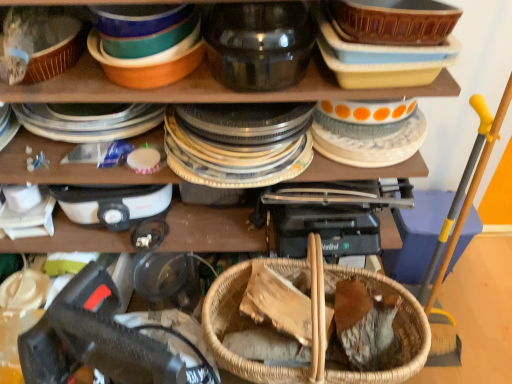
Question: Considering the relative sizes of woven wood basket at center and transparent glass jar at upper center, the first tableware from the left, in the image provided, is woven wood basket at center wider than transparent glass jar at upper center, the first tableware from the left,?

Choices:
 (A) no
 (B) yes

Answer: (A)

Question: Can you confirm if woven wood basket at center is positioned to the right of transparent glass jar at upper center, the second tableware in the right-to-left sequence?

Choices:
 (A) no
 (B) yes

Answer: (B)

Question: Can you confirm if woven wood basket at center is smaller than transparent glass jar at upper center, the second tableware in the right-to-left sequence?

Choices:
 (A) no
 (B) yes

Answer: (A)

Question: From a real-world perspective, is woven wood basket at center positioned under transparent glass jar at upper center, the first tableware from the left, based on gravity?

Choices:
 (A) yes
 (B) no

Answer: (A)

Question: Does woven wood basket at center have a lesser height compared to transparent glass jar at upper center, the second tableware in the right-to-left sequence?

Choices:
 (A) no
 (B) yes

Answer: (A)

Question: From a real-world perspective, is woven wood basket at center positioned over transparent glass jar at upper center, the second tableware in the right-to-left sequence, based on gravity?

Choices:
 (A) no
 (B) yes

Answer: (A)

Question: Is transparent glass jar at upper center, the second tableware in the right-to-left sequence, further to camera compared to white plastic appliance at upper left?

Choices:
 (A) yes
 (B) no

Answer: (B)

Question: Does transparent glass jar at upper center, the first tableware from the left, appear on the left side of white plastic appliance at upper left?

Choices:
 (A) yes
 (B) no

Answer: (B)

Question: Can you confirm if transparent glass jar at upper center, the first tableware from the left, is positioned to the right of white plastic appliance at upper left?

Choices:
 (A) yes
 (B) no

Answer: (A)

Question: From a real-world perspective, is transparent glass jar at upper center, the first tableware from the left, physically below white plastic appliance at upper left?

Choices:
 (A) yes
 (B) no

Answer: (B)

Question: Does transparent glass jar at upper center, the first tableware from the left, have a lesser width compared to white plastic appliance at upper left?

Choices:
 (A) yes
 (B) no

Answer: (B)

Question: Is transparent glass jar at upper center, the second tableware in the right-to-left sequence, closer to the viewer compared to white plastic appliance at upper left?

Choices:
 (A) yes
 (B) no

Answer: (A)

Question: From the image's perspective, would you say white glossy plate at upper right, the 2th tableware positioned from the left, is positioned over woven wood basket at center?

Choices:
 (A) no
 (B) yes

Answer: (B)